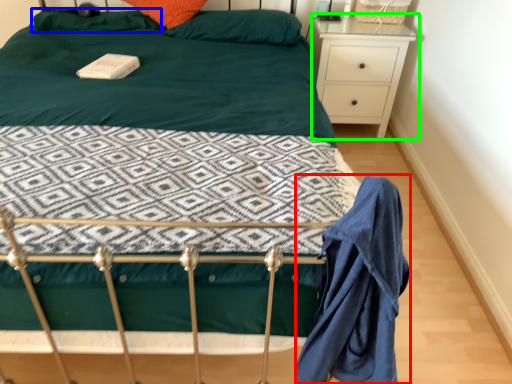
Question: Based on their relative distances, which object is farther from robe (highlighted by a red box)? Choose from pillow (highlighted by a blue box) and nightstand (highlighted by a green box).

Choices:
 (A) pillow
 (B) nightstand

Answer: (A)